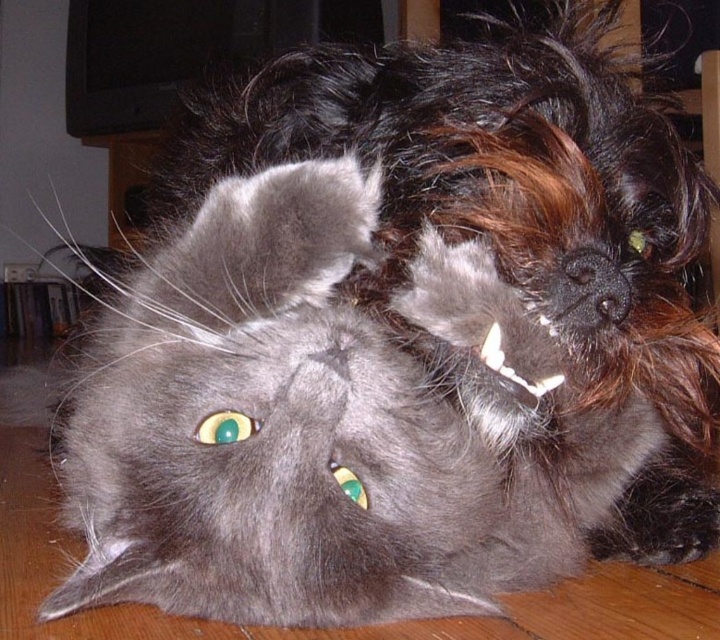
You are a photographer standing at a certain distance from the soft gray fur cat at center. You want to take a closeup photo of it. The camera requires the subject to be within 60 centimeters to focus properly. Do you need to move closer or farther away?

The distance between the soft gray fur cat at center and the camera is 67.79 centimeters. Since the camera needs the subject within 60 centimeters to focus, you need to move closer to the soft gray fur cat at center to reduce the distance below 60 centimeters.

You are a veterinarian examining two animals in the same room. You notice the soft gray fur cat at center and the shiny black fur at center. Which animal has a smaller body width?

The soft gray fur cat at center is thinner than the shiny black fur at center, so the soft gray fur cat at center has a smaller body width.